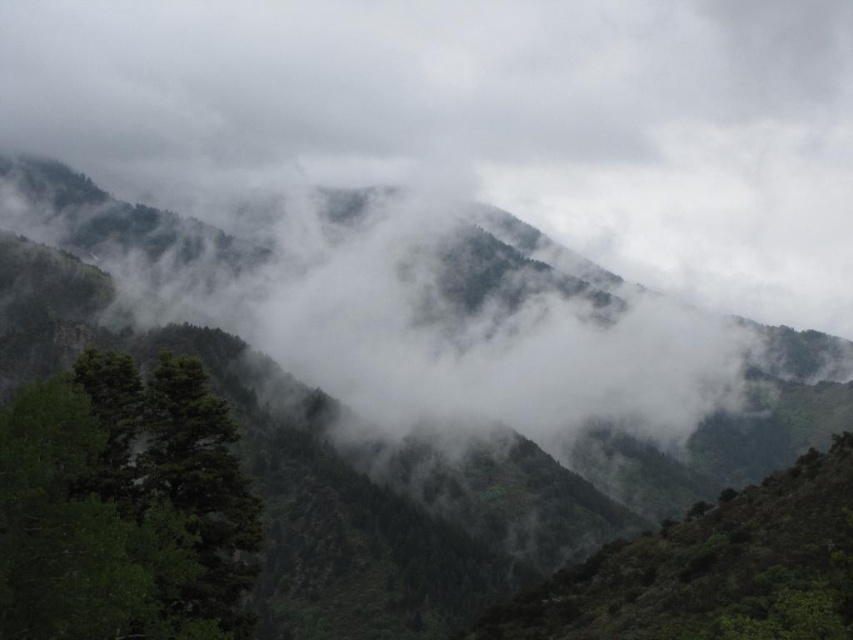
Question: Is white fluffy cloud at upper center closer to camera compared to green matte tree at lower left?

Choices:
 (A) yes
 (B) no

Answer: (B)

Question: Does white fluffy cloud at upper center have a lesser width compared to green matte tree at lower left?

Choices:
 (A) yes
 (B) no

Answer: (B)

Question: Can you confirm if white fluffy cloud at upper center is positioned below green matte tree at lower left?

Choices:
 (A) no
 (B) yes

Answer: (A)